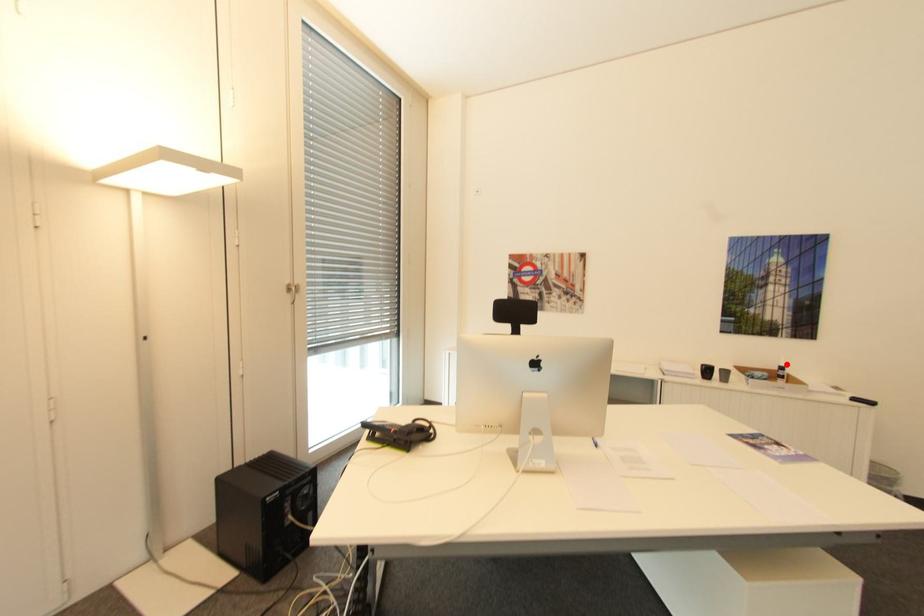
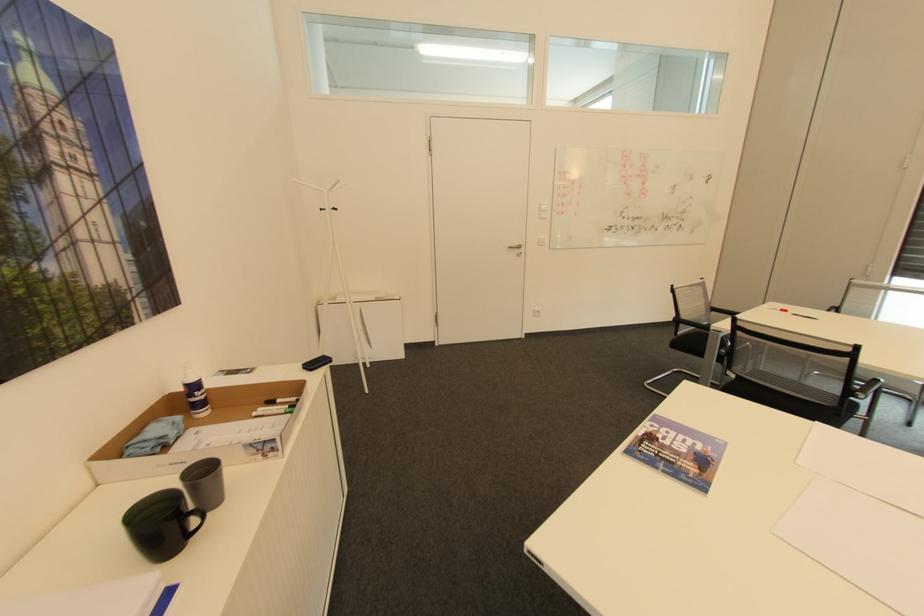
Question: I am providing you with two images of the same scene from different viewpoints. Given a red point in image1, look at the same physical point in image2. Is it:

Choices:
 (A) Closer to the viewpoint
 (B) Farther from the viewpoint

Answer: (A)